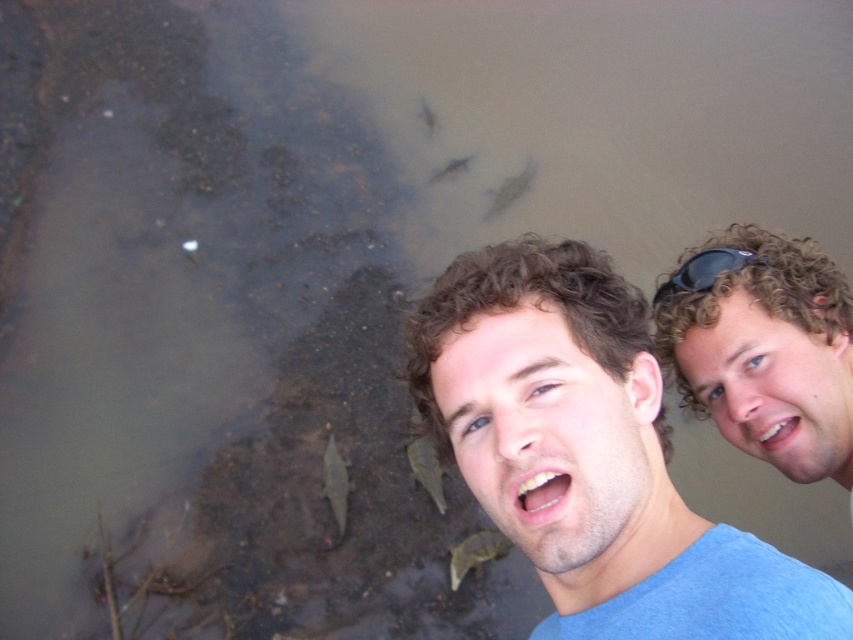
Does blue matte shirt at lower right have a greater height compared to translucent grayish fish at center?

Correct, blue matte shirt at lower right is much taller as translucent grayish fish at center.

Which of these two, blue matte shirt at lower right or translucent grayish fish at center, stands taller?

blue matte shirt at lower right is taller.

Is point (740, 621) more distant than point (438, 467)?

No, (740, 621) is in front of (438, 467).

Find the location of `blue matte shirt at lower right`. blue matte shirt at lower right is located at coordinates (590, 454).

Is the position of black rubber goggles at upper right less distant than that of translucent grayish fish at center?

That is True.

Can you confirm if black rubber goggles at upper right is wider than translucent grayish fish at center?

No.

In order to click on black rubber goggles at upper right in this screenshot , I will do `click(705, 269)`.

Where is `black rubber goggles at upper right`? black rubber goggles at upper right is located at coordinates (705, 269).

Does point (662, 492) come in front of point (453, 576)?

Yes, point (662, 492) is in front of point (453, 576).

Can you confirm if blue matte shirt at lower right is wider than green matte fish at lower center?

Indeed, blue matte shirt at lower right has a greater width compared to green matte fish at lower center.

Is point (827, 632) more distant than point (479, 554)?

No, (827, 632) is closer to viewer.

What are the coordinates of `blue matte shirt at lower right` in the screenshot? It's located at (590, 454).